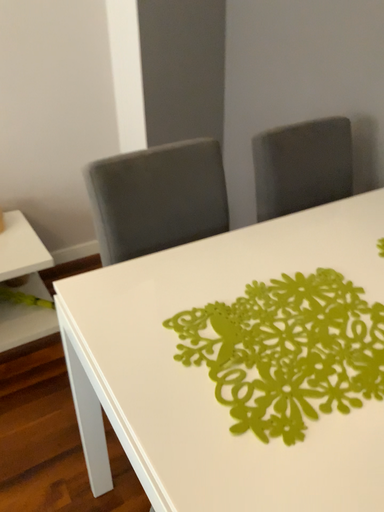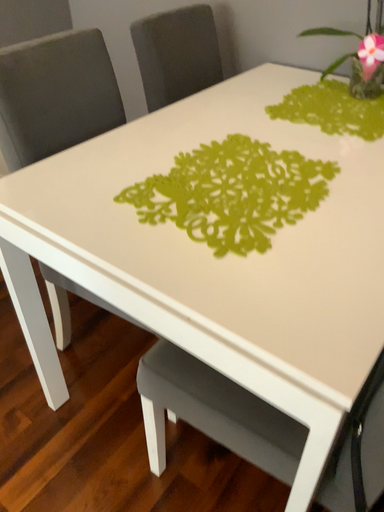
Question: Which way did the camera rotate in the video?

Choices:
 (A) rotated left
 (B) rotated right

Answer: (B)